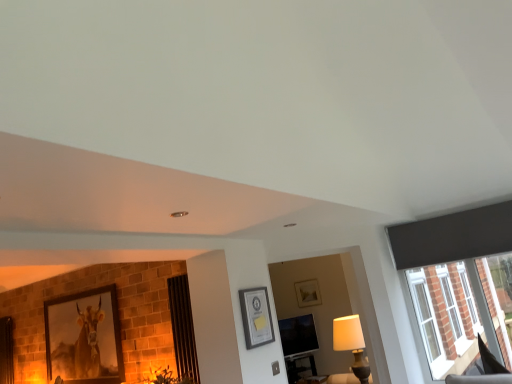
Describe the element at coordinates (484, 369) in the screenshot. I see `black leather swivel chair at lower right` at that location.

Describe the element at coordinates (84, 337) in the screenshot. I see `matte wooden picture frame at left, which is counted as the 2th picture frame, starting from the right` at that location.

Identify the location of matte black screen at center. The image size is (512, 384). (298, 335).

At what (x,y) coordinates should I click in order to perform the action: click on black leather swivel chair at lower right. Please return your answer as a coordinate pair (x, y). Looking at the image, I should click on (484, 369).

From the image's perspective, would you say white fabric lampshade at lower right is shown under matte black screen at center?

Incorrect, from the image's perspective, white fabric lampshade at lower right is higher than matte black screen at center.

Is white fabric lampshade at lower right smaller than matte black screen at center?

Incorrect, white fabric lampshade at lower right is not smaller in size than matte black screen at center.

From a real-world perspective, is white fabric lampshade at lower right above or below matte black screen at center?

white fabric lampshade at lower right is situated higher than matte black screen at center in the real world.

Is white fabric lampshade at lower right directly adjacent to matte black screen at center?

No.

Which is correct: matte black picture frame at center, which appears as the first picture frame when viewed from the front, is inside white fabric lampshade at lower right, or outside of it?

matte black picture frame at center, which appears as the first picture frame when viewed from the front, is outside white fabric lampshade at lower right.

Consider the image. From the image's perspective, is matte black picture frame at center, placed as the second picture frame when sorted from left to right, under white fabric lampshade at lower right?

Incorrect, from the image's perspective, matte black picture frame at center, placed as the second picture frame when sorted from left to right, is higher than white fabric lampshade at lower right.

Is matte black picture frame at center, which is the first picture frame from right to left, turned away from white fabric lampshade at lower right?

matte black picture frame at center, which is the first picture frame from right to left, does not have its back to white fabric lampshade at lower right.

Find the location of a particular element. The height and width of the screenshot is (384, 512). the 1st picture frame above the white fabric lampshade at lower right (from a real-world perspective) is located at coordinates (256, 317).

Which point is more forward, (105, 324) or (361, 334)?

Positioned in front is point (361, 334).

Consider the image. From a real-world perspective, which is physically below, matte wooden picture frame at left, which is counted as the 2th picture frame, starting from the right, or white fabric lampshade at lower right?

In real-world perspective, white fabric lampshade at lower right is lower.

From the image's perspective, is matte wooden picture frame at left, which ranks as the first picture frame in back-to-front order, over white fabric lampshade at lower right?

Correct, matte wooden picture frame at left, which ranks as the first picture frame in back-to-front order, appears higher than white fabric lampshade at lower right in the image.

Which is in front, matte wooden picture frame at left, which appears as the second picture frame when viewed from the top, or white fabric lampshade at lower right?

white fabric lampshade at lower right is more forward.

From the image's perspective, which is above, black leather swivel chair at lower right or matte wooden picture frame at left, the 1th picture frame from the left?

black leather swivel chair at lower right appears higher in the image.

Is black leather swivel chair at lower right positioned before matte wooden picture frame at left, which ranks as the first picture frame in back-to-front order?

Yes, it is.

Considering the sizes of objects black leather swivel chair at lower right and matte wooden picture frame at left, which appears as the second picture frame when viewed from the top, in the image provided, who is thinner, black leather swivel chair at lower right or matte wooden picture frame at left, which appears as the second picture frame when viewed from the top,?

Thinner between the two is black leather swivel chair at lower right.

The width and height of the screenshot is (512, 384). Find the location of `swivel chair on the right of matte wooden picture frame at left, which ranks as the first picture frame in back-to-front order`. swivel chair on the right of matte wooden picture frame at left, which ranks as the first picture frame in back-to-front order is located at coordinates (484, 369).

Who is taller, matte wooden picture frame at left, positioned as the first picture frame in bottom-to-top order, or matte black screen at center?

With more height is matte wooden picture frame at left, positioned as the first picture frame in bottom-to-top order.

Which object is further away from the camera, matte wooden picture frame at left, the 2th picture frame in the front-to-back sequence, or matte black screen at center?

matte black screen at center is further from the camera.

Does matte wooden picture frame at left, which appears as the second picture frame when viewed from the top, appear on the left side of matte black screen at center?

Indeed, matte wooden picture frame at left, which appears as the second picture frame when viewed from the top, is positioned on the left side of matte black screen at center.

You are a GUI agent. You are given a task and a screenshot of the screen. Output one action in this format:
    pyautogui.click(x=<x>, y=<y>)
    Task: Click on the 1st picture frame in front of the matte black screen at center, starting your count from the anchor
    The height and width of the screenshot is (384, 512).
    Given the screenshot: What is the action you would take?
    pyautogui.click(x=84, y=337)

Is matte black picture frame at center, placed as the second picture frame when sorted from left to right, surrounded by white fabric lampshade at lower right?

No, matte black picture frame at center, placed as the second picture frame when sorted from left to right, is located outside of white fabric lampshade at lower right.

Is white fabric lampshade at lower right bigger than matte black picture frame at center, which appears as the first picture frame when viewed from the front?

Indeed, white fabric lampshade at lower right has a larger size compared to matte black picture frame at center, which appears as the first picture frame when viewed from the front.

Could you measure the distance between white fabric lampshade at lower right and matte black picture frame at center, placed as the second picture frame when sorted from left to right?

4.36 feet.

Can you confirm if white fabric lampshade at lower right is taller than matte black picture frame at center, placed as the second picture frame when sorted from left to right?

Yes.

Would you say matte black screen at center is inside or outside matte black picture frame at center, which is the second picture frame in bottom-to-top order?

The correct answer is: outside.

Between matte black screen at center and matte black picture frame at center, placed as the second picture frame when sorted from left to right, which one is positioned behind?

Positioned behind is matte black screen at center.

From the image's perspective, is matte black screen at center over matte black picture frame at center, which is the second picture frame in bottom-to-top order?

Actually, matte black screen at center appears below matte black picture frame at center, which is the second picture frame in bottom-to-top order, in the image.

From a real-world perspective, is matte black screen at center on top of matte black picture frame at center, placed as the 1th picture frame when sorted from top to bottom?

No.

What are the coordinates of `window screen behind the white fabric lampshade at lower right` in the screenshot? It's located at (298, 335).

At what (x,y) coordinates should I click in order to perform the action: click on lamp on the right of matte black picture frame at center, which is the second picture frame in bottom-to-top order. Please return your answer as a coordinate pair (x, y). The image size is (512, 384). Looking at the image, I should click on (351, 344).

Based on their spatial positions, is matte wooden picture frame at left, which ranks as the first picture frame in back-to-front order, or matte black picture frame at center, the 2th picture frame viewed from the back, closer to black leather swivel chair at lower right?

matte black picture frame at center, the 2th picture frame viewed from the back, lies closer to black leather swivel chair at lower right than the other object.

Which object lies further to the anchor point white fabric lampshade at lower right, matte black picture frame at center, placed as the 1th picture frame when sorted from top to bottom, or matte black screen at center?

Among the two, matte black screen at center is located further to white fabric lampshade at lower right.

Estimate the real-world distances between objects in this image. Which object is further from black leather swivel chair at lower right, matte black picture frame at center, the 2th picture frame viewed from the back, or matte wooden picture frame at left, which is counted as the 2th picture frame, starting from the right?

matte wooden picture frame at left, which is counted as the 2th picture frame, starting from the right.

From the image, which object appears to be nearer to black leather swivel chair at lower right, matte black picture frame at center, which appears as the first picture frame when viewed from the front, or matte black screen at center?

Based on the image, matte black picture frame at center, which appears as the first picture frame when viewed from the front, appears to be nearer to black leather swivel chair at lower right.

Based on the photo, from the image, which object appears to be farther from matte wooden picture frame at left, which ranks as the first picture frame in back-to-front order, matte black picture frame at center, placed as the second picture frame when sorted from left to right, or matte black screen at center?

matte black screen at center is positioned further to the anchor matte wooden picture frame at left, which ranks as the first picture frame in back-to-front order.

Which object lies further to the anchor point white fabric lampshade at lower right, matte wooden picture frame at left, the 2th picture frame in the front-to-back sequence, or black leather swivel chair at lower right?

matte wooden picture frame at left, the 2th picture frame in the front-to-back sequence.

From the image, which object appears to be farther from white fabric lampshade at lower right, black leather swivel chair at lower right or matte wooden picture frame at left, which is counted as the 2th picture frame, starting from the right?

matte wooden picture frame at left, which is counted as the 2th picture frame, starting from the right, is positioned further to the anchor white fabric lampshade at lower right.

From the image, which object appears to be nearer to matte black screen at center, matte black picture frame at center, which appears as the first picture frame when viewed from the front, or white fabric lampshade at lower right?

Among the two, white fabric lampshade at lower right is located nearer to matte black screen at center.

Identify the location of lamp located between matte black picture frame at center, placed as the second picture frame when sorted from left to right, and black leather swivel chair at lower right in the left-right direction. (351, 344).

At what (x,y) coordinates should I click in order to perform the action: click on lamp located between black leather swivel chair at lower right and matte black screen at center in the depth direction. Please return your answer as a coordinate pair (x, y). Image resolution: width=512 pixels, height=384 pixels. Looking at the image, I should click on (351, 344).

Locate an element on the screen. swivel chair positioned between matte black picture frame at center, the 2th picture frame viewed from the back, and matte black screen at center from near to far is located at coordinates (484, 369).

The height and width of the screenshot is (384, 512). In order to click on picture frame positioned between matte black picture frame at center, which is the second picture frame in bottom-to-top order, and matte black screen at center from near to far in this screenshot , I will do `click(84, 337)`.